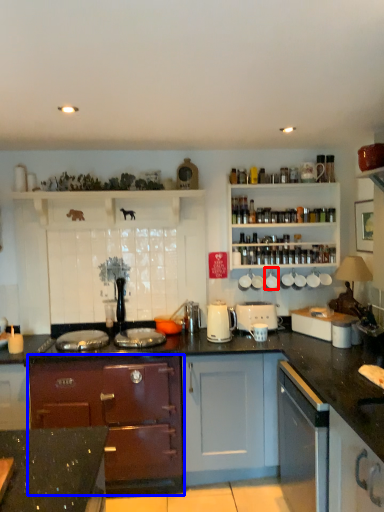
Question: Which object is closer to the camera taking this photo, appliance (highlighted by a red box) or cabinetry (highlighted by a blue box)?

Choices:
 (A) appliance
 (B) cabinetry

Answer: (B)